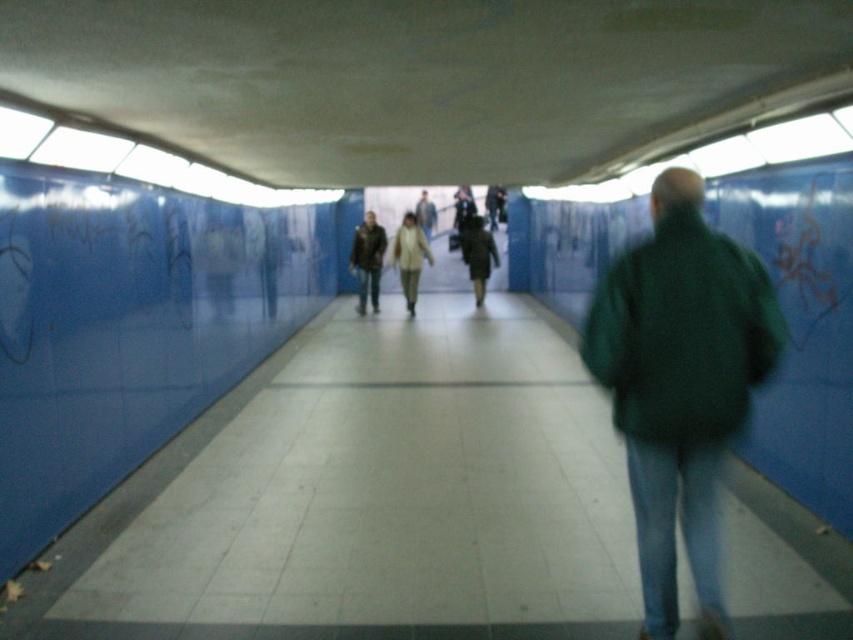
Is point (405, 276) positioned behind point (479, 259)?

No.

Who is higher up, light beige fabric coat at center or dark gray coat at center?

Positioned higher is dark gray coat at center.

This screenshot has width=853, height=640. Describe the element at coordinates (409, 257) in the screenshot. I see `light beige fabric coat at center` at that location.

Locate an element on the screen. Image resolution: width=853 pixels, height=640 pixels. light beige fabric coat at center is located at coordinates (409, 257).

Can you confirm if green matte jacket at right is thinner than matte brown jacket at center?

No, green matte jacket at right is not thinner than matte brown jacket at center.

Is green matte jacket at right shorter than matte brown jacket at center?

No.

Which is in front, point (708, 340) or point (366, 284)?

Point (708, 340) is more forward.

Where is `green matte jacket at right`? The height and width of the screenshot is (640, 853). green matte jacket at right is located at coordinates (680, 384).

Can you confirm if green matte jacket at right is positioned to the left of dark gray coat at center?

Correct, you'll find green matte jacket at right to the left of dark gray coat at center.

Is green matte jacket at right to the right of dark gray coat at center from the viewer's perspective?

In fact, green matte jacket at right is to the left of dark gray coat at center.

Does point (718, 259) come in front of point (490, 257)?

That is True.

Where is `green matte jacket at right`? green matte jacket at right is located at coordinates (680, 384).